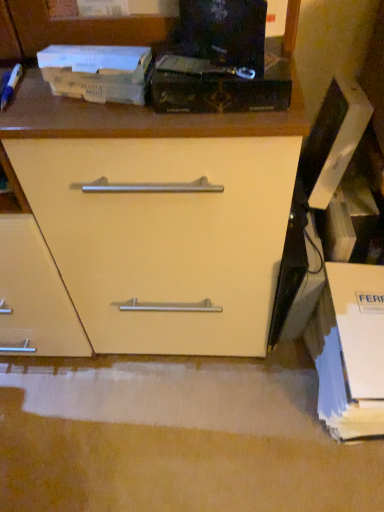
Question: In which direction should I rotate to look at black matte paperback book at upper center, marked as the 2th paperback book in a left-to-right arrangement?

Choices:
 (A) right
 (B) left

Answer: (A)

Question: Can you confirm if white cardboard box at lower right is positioned to the left of black matte paperback book at upper center, which appears as the 1th paperback book when viewed from the right?

Choices:
 (A) no
 (B) yes

Answer: (A)

Question: Is white cardboard box at lower right at the right side of black matte paperback book at upper center, marked as the 2th paperback book in a left-to-right arrangement?

Choices:
 (A) no
 (B) yes

Answer: (B)

Question: Could black matte paperback book at upper center, marked as the 2th paperback book in a left-to-right arrangement, be considered to be inside white cardboard box at lower right?

Choices:
 (A) no
 (B) yes

Answer: (A)

Question: Can you confirm if white cardboard box at lower right is thinner than black matte paperback book at upper center, marked as the 2th paperback book in a left-to-right arrangement?

Choices:
 (A) yes
 (B) no

Answer: (B)

Question: From a real-world perspective, is white cardboard box at lower right below black matte paperback book at upper center, which appears as the 1th paperback book when viewed from the right?

Choices:
 (A) no
 (B) yes

Answer: (B)

Question: From the image's perspective, is white cardboard box at lower right over black matte paperback book at upper center, marked as the 2th paperback book in a left-to-right arrangement?

Choices:
 (A) yes
 (B) no

Answer: (B)

Question: Is black matte paperback book at upper center, which appears as the 1th paperback book when viewed from the right, looking in the opposite direction of white cardboard box at lower right?

Choices:
 (A) no
 (B) yes

Answer: (A)

Question: Does black matte paperback book at upper center, marked as the 2th paperback book in a left-to-right arrangement, have a lesser width compared to white cardboard box at lower right?

Choices:
 (A) no
 (B) yes

Answer: (B)

Question: From a real-world perspective, is black matte paperback book at upper center, which appears as the 1th paperback book when viewed from the right, on top of white cardboard box at lower right?

Choices:
 (A) no
 (B) yes

Answer: (B)

Question: Considering the relative sizes of black matte paperback book at upper center, which appears as the 1th paperback book when viewed from the right, and white cardboard box at lower right in the image provided, is black matte paperback book at upper center, which appears as the 1th paperback book when viewed from the right, bigger than white cardboard box at lower right?

Choices:
 (A) yes
 (B) no

Answer: (B)

Question: Considering the relative positions of black matte paperback book at upper center, which appears as the 1th paperback book when viewed from the right, and white cardboard box at lower right in the image provided, is black matte paperback book at upper center, which appears as the 1th paperback book when viewed from the right, in front of white cardboard box at lower right?

Choices:
 (A) no
 (B) yes

Answer: (B)

Question: Is black matte paperback book at upper center, marked as the 2th paperback book in a left-to-right arrangement, at the left side of white cardboard box at lower right?

Choices:
 (A) yes
 (B) no

Answer: (A)

Question: Is white cardboard box at lower right closer to the viewer compared to brown cardboard book at upper left, arranged as the 2th paperback book when viewed from the right?

Choices:
 (A) no
 (B) yes

Answer: (A)